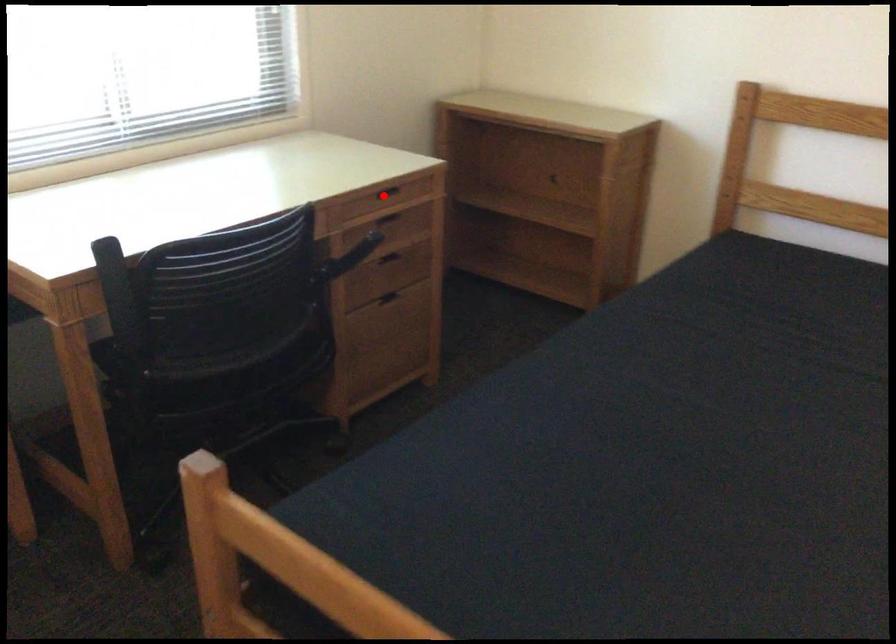
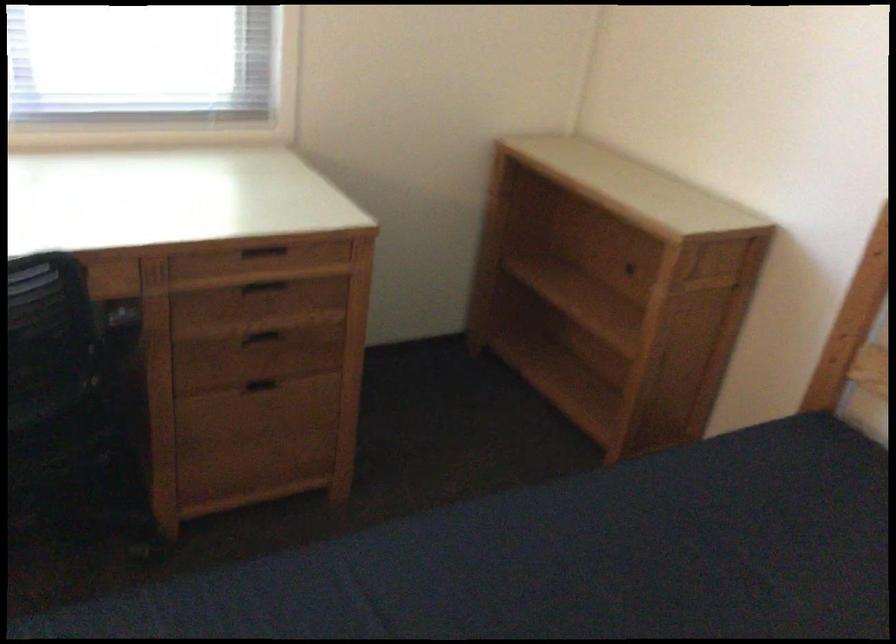
Question: I am providing you with two images of the same scene from different viewpoints. Image1 has a red point marked. In image2, the corresponding 3D location appears at what relative position? Reply with the corresponding letter.

Choices:
 (A) Closer
 (B) Farther

Answer: (A)